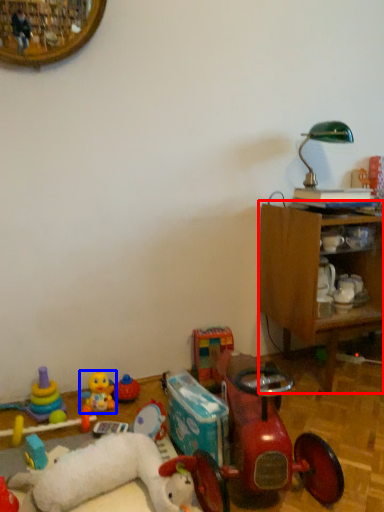
Question: Which object is closer to the camera taking this photo, furniture (highlighted by a red box) or toy (highlighted by a blue box)?

Choices:
 (A) furniture
 (B) toy

Answer: (A)